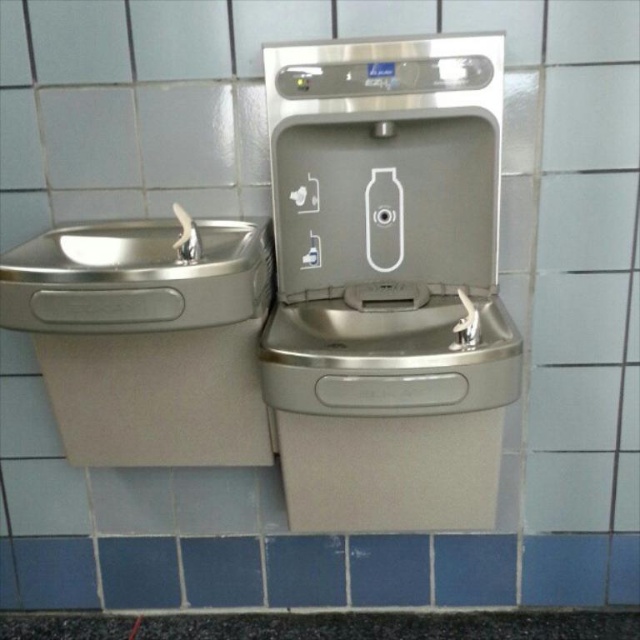
Is point (307, 259) positioned in front of point (330, 588)?

Yes, point (307, 259) is in front of point (330, 588).

Which is above, satin nickel faucet at upper center or blue tile at center?

Positioned higher is satin nickel faucet at upper center.

Is point (432, 244) closer to camera compared to point (289, 602)?

That is True.

Find the location of a particular element. satin nickel faucet at upper center is located at coordinates (385, 163).

Between satin nickel faucet at upper center and brushed metal sink at left, which one is positioned lower?

brushed metal sink at left

The image size is (640, 640). What do you see at coordinates (385, 163) in the screenshot?
I see `satin nickel faucet at upper center` at bounding box center [385, 163].

Image resolution: width=640 pixels, height=640 pixels. What do you see at coordinates (385, 163) in the screenshot? I see `satin nickel faucet at upper center` at bounding box center [385, 163].

You are a GUI agent. You are given a task and a screenshot of the screen. Output one action in this format:
    pyautogui.click(x=<x>, y=<y>)
    Task: Click on the satin nickel faucet at upper center
    
    Given the screenshot: What is the action you would take?
    pyautogui.click(x=385, y=163)

Does brushed metal sink at left have a greater width compared to blue tile at center?

Correct, the width of brushed metal sink at left exceeds that of blue tile at center.

Who is positioned more to the right, brushed metal sink at left or blue tile at center?

From the viewer's perspective, blue tile at center appears more on the right side.

From the picture: Who is more forward, (147, 260) or (324, 538)?

Point (147, 260) is more forward.

Image resolution: width=640 pixels, height=640 pixels. Find the location of `brushed metal sink at left`. brushed metal sink at left is located at coordinates (136, 276).